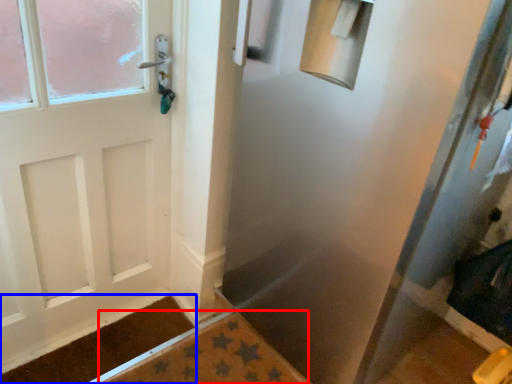
Question: Which object appears closest to the camera in this image, bath mat (highlighted by a red box) or doormat (highlighted by a blue box)?

Choices:
 (A) bath mat
 (B) doormat

Answer: (A)